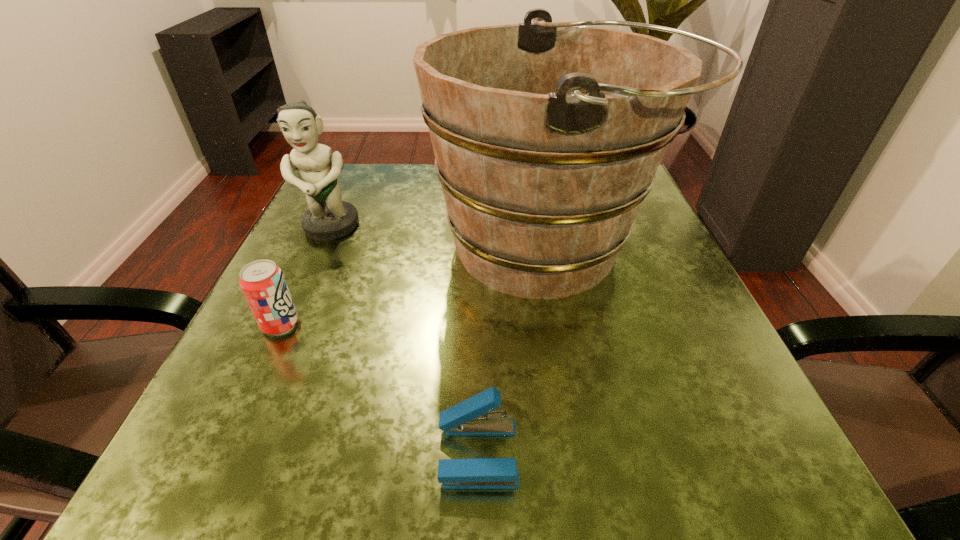
You are a GUI agent. You are given a task and a screenshot of the screen. Output one action in this format:
    pyautogui.click(x=<x>, y=<y>)
    Task: Click on the free space at the far left corner of the desktop
    The image size is (960, 540).
    Given the screenshot: What is the action you would take?
    (x=389, y=180)

Where is `vacant space at the near right corner of the desktop`? This screenshot has height=540, width=960. vacant space at the near right corner of the desktop is located at coordinates (781, 485).

Locate an element on the screen. free space between the tallest object and the soda can is located at coordinates (415, 286).

This screenshot has height=540, width=960. Find the location of `vacant region between the shortest object and the second shortest object`. vacant region between the shortest object and the second shortest object is located at coordinates (379, 389).

Where is `free area in between the bucket and the soda can`? free area in between the bucket and the soda can is located at coordinates (415, 286).

Find the location of a particular element. Image resolution: width=960 pixels, height=540 pixels. free spot between the nearest object and the figurine is located at coordinates (404, 341).

Find the location of `free point between the third tallest object and the shortest object`. free point between the third tallest object and the shortest object is located at coordinates (379, 389).

The height and width of the screenshot is (540, 960). Identify the location of free space between the shortest object and the second shortest object. (379, 389).

Find the location of a particular element. This screenshot has width=960, height=540. vacant point located between the figurine and the tallest object is located at coordinates (440, 238).

You are a GUI agent. You are given a task and a screenshot of the screen. Output one action in this format:
    pyautogui.click(x=<x>, y=<y>)
    Task: Click on the free space between the third shortest object and the tallest object
    This screenshot has width=960, height=540.
    Given the screenshot: What is the action you would take?
    (x=440, y=238)